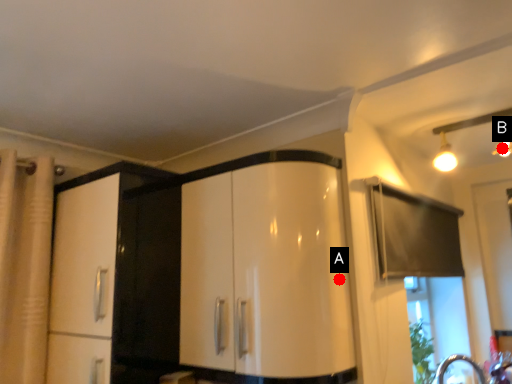
Question: Two points are circled on the image, labeled by A and B beside each circle. Which point is farther to the camera?

Choices:
 (A) A is further
 (B) B is further

Answer: (B)